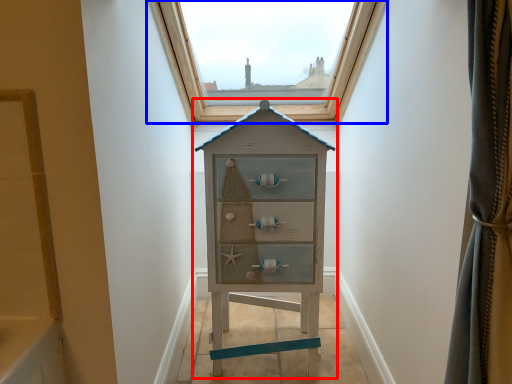
Question: Among these objects, which one is nearest to the camera, chest of drawers (highlighted by a red box) or window (highlighted by a blue box)?

Choices:
 (A) chest of drawers
 (B) window

Answer: (A)